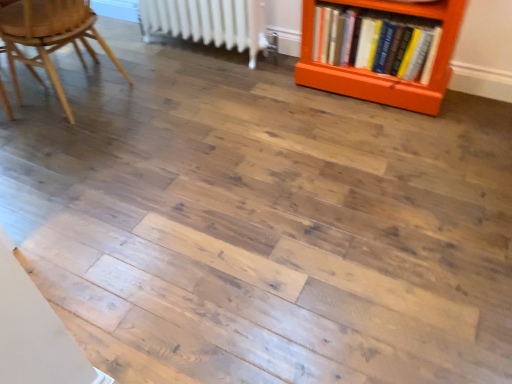
This screenshot has height=384, width=512. Find the location of `free space behind wooden chair at left`. free space behind wooden chair at left is located at coordinates (115, 56).